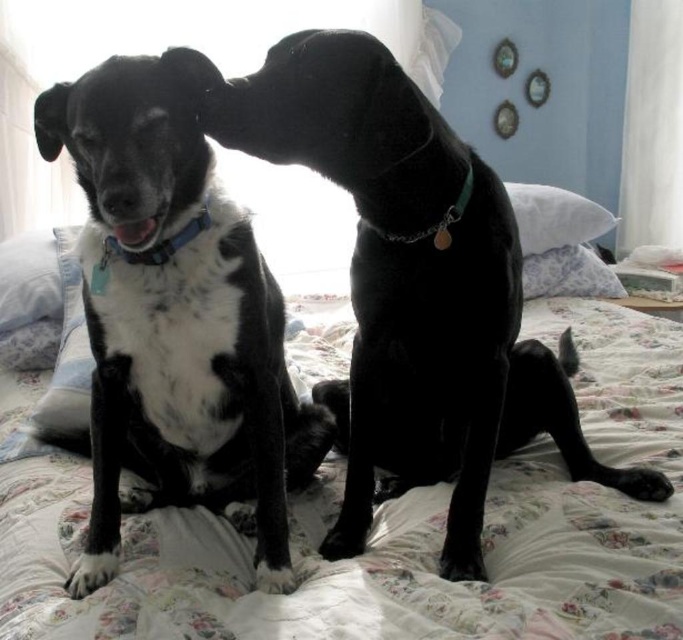
Does point (96, 561) come behind point (656, 484)?

No.

Measure the distance between white soft paw at lower left and camera.

white soft paw at lower left and camera are 36.77 inches apart from each other.

Find the location of a particular element. This screenshot has width=683, height=640. white soft paw at lower left is located at coordinates (92, 572).

Can you confirm if black shiny dog at center is shorter than black rubber nose at center?

No, black shiny dog at center is not shorter than black rubber nose at center.

Who is positioned more to the right, black shiny dog at center or black rubber nose at center?

black shiny dog at center is more to the right.

From the picture: Who is more distant from viewer, (279,67) or (229,84)?

Point (279,67)

Where is `black shiny dog at center`? The height and width of the screenshot is (640, 683). black shiny dog at center is located at coordinates (393, 250).

Is point (335, 182) less distant than point (647, 500)?

Yes, point (335, 182) is in front of point (647, 500).

Is black shiny dog at center positioned at the back of black matte paw at lower right?

No, it is in front of black matte paw at lower right.

Is point (518, 307) more distant than point (611, 470)?

No, (518, 307) is closer to viewer.

The height and width of the screenshot is (640, 683). Identify the location of black shiny dog at center. (393, 250).